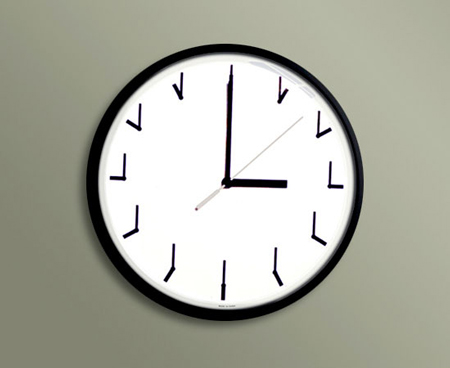
Locate an element on the screen. wall is located at coordinates (393, 86).